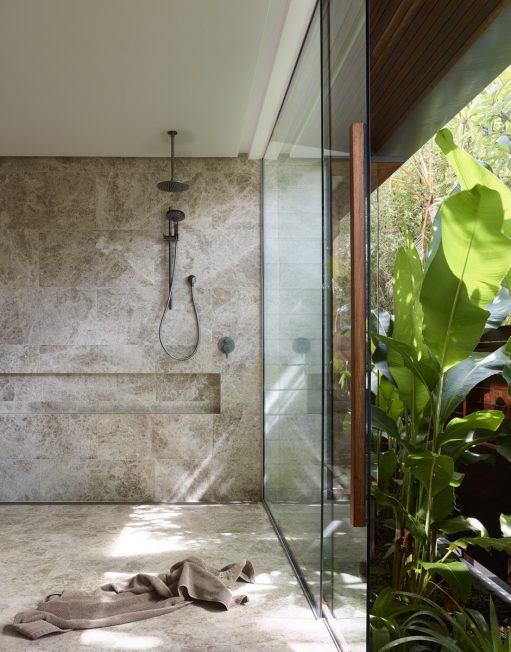
The width and height of the screenshot is (511, 652). I want to click on water lever handle, so coord(224,349).